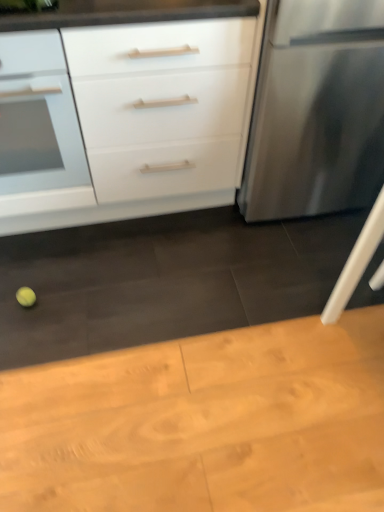
This screenshot has height=512, width=384. Find the location of `free location in front of yellow matte tennis ball at lower left`. free location in front of yellow matte tennis ball at lower left is located at coordinates (x=29, y=330).